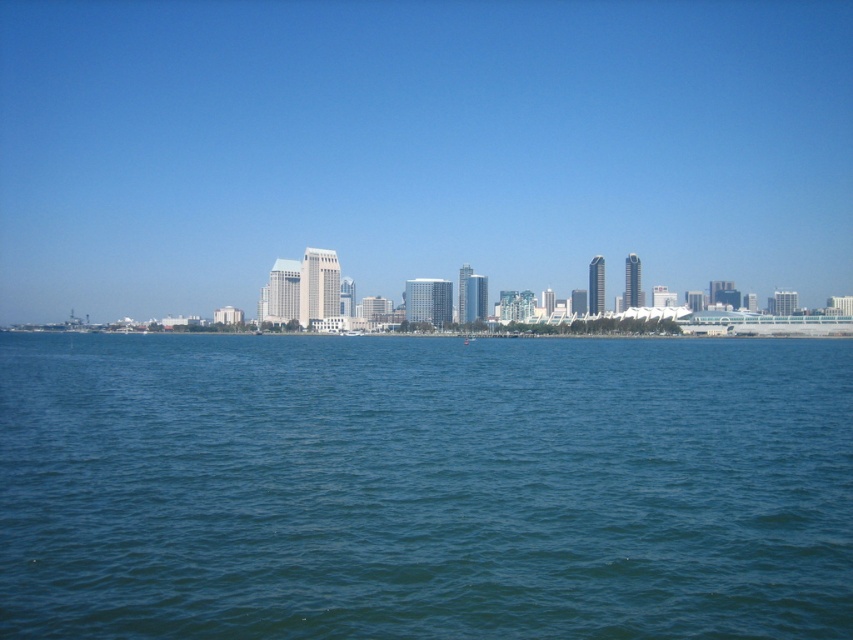
Question: Which object appears farthest from the camera in this image?

Choices:
 (A) transparent glass skyline at center
 (B) blue water at center

Answer: (A)

Question: In this image, where is blue water at center located relative to transparent glass skyline at center?

Choices:
 (A) left
 (B) right

Answer: (B)

Question: Which point appears farthest from the camera in this image?

Choices:
 (A) (735, 385)
 (B) (70, 100)

Answer: (B)

Question: Which object is closer to the camera taking this photo?

Choices:
 (A) blue water at center
 (B) transparent glass skyline at center

Answer: (A)

Question: Is blue water at center thinner than transparent glass skyline at center?

Choices:
 (A) yes
 (B) no

Answer: (A)

Question: Is blue water at center below transparent glass skyline at center?

Choices:
 (A) no
 (B) yes

Answer: (B)